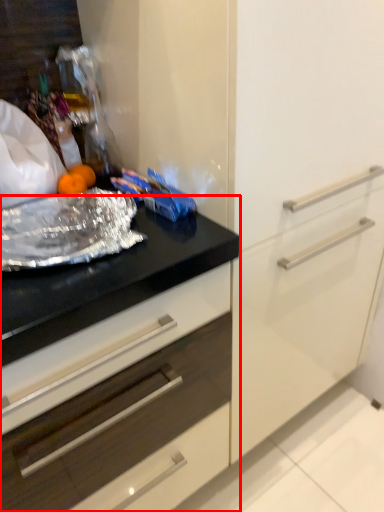
Question: From the image's perspective, considering the relative positions of countertop (annotated by the red box) and material in the image provided, where is countertop (annotated by the red box) located with respect to the staircase?

Choices:
 (A) above
 (B) below

Answer: (B)